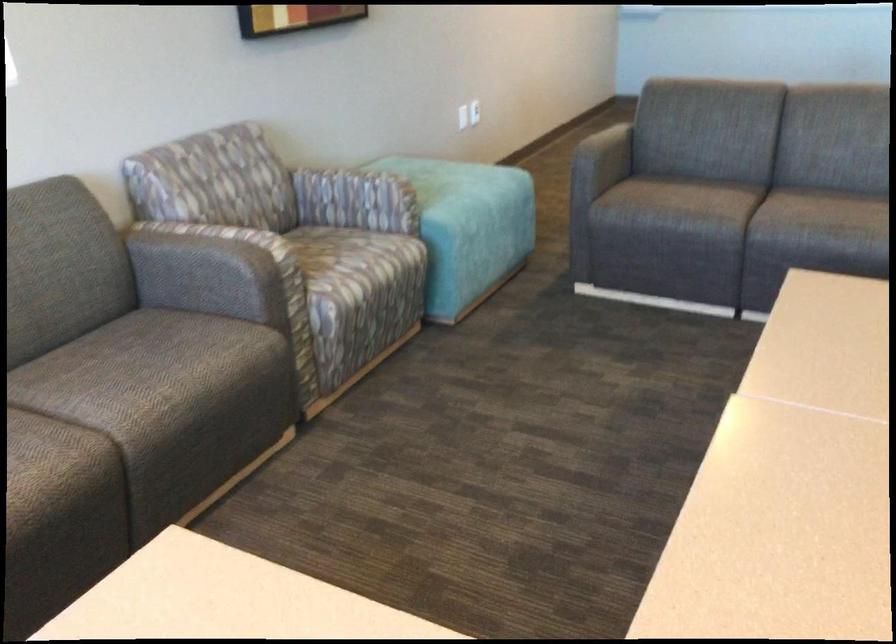
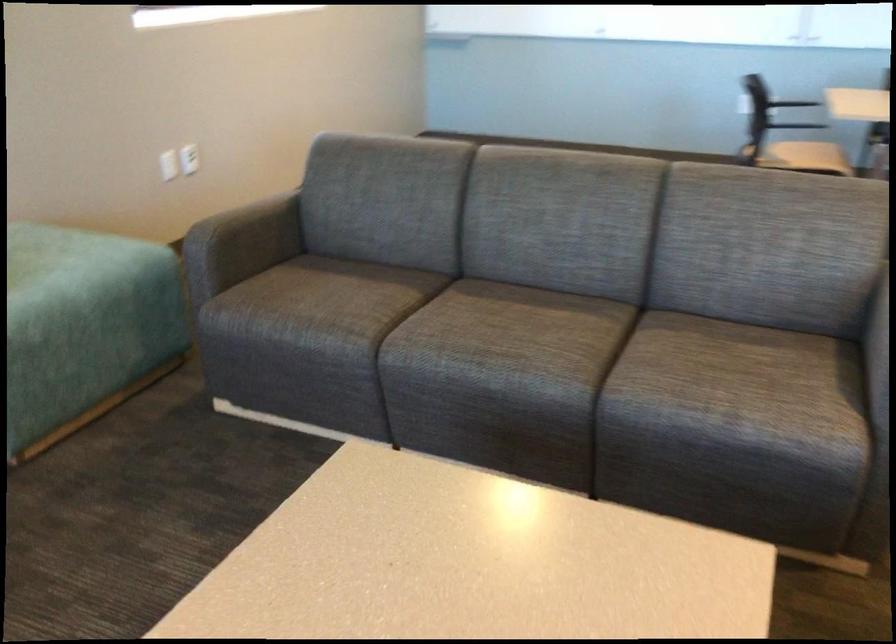
In the second image, find the point that corresponds to pixel 728 222 in the first image.

(358, 343)